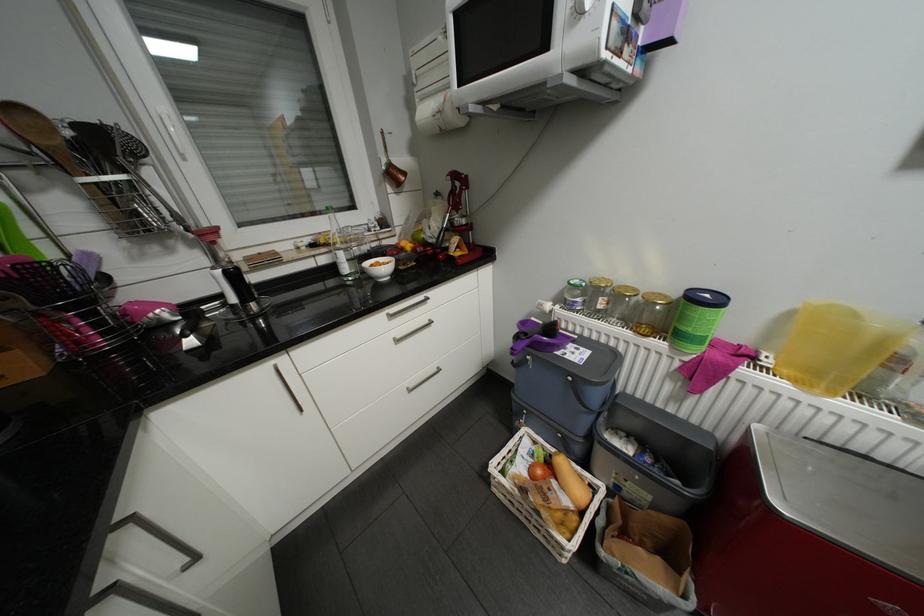
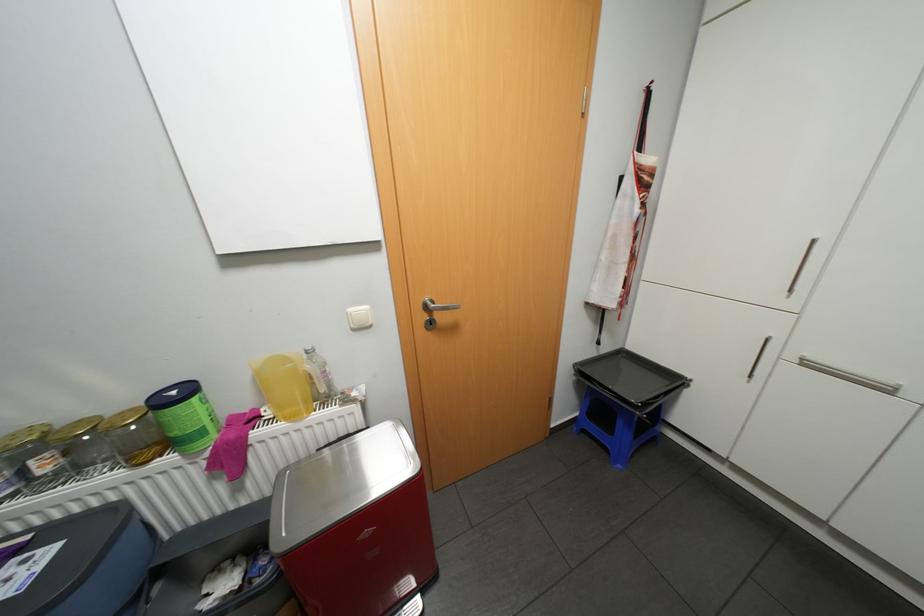
Question: The first image is from the beginning of the video and the second image is from the end. How did the camera likely rotate when shooting the video?

Choices:
 (A) Left
 (B) Right
 (C) Up
 (D) Down

Answer: (B)